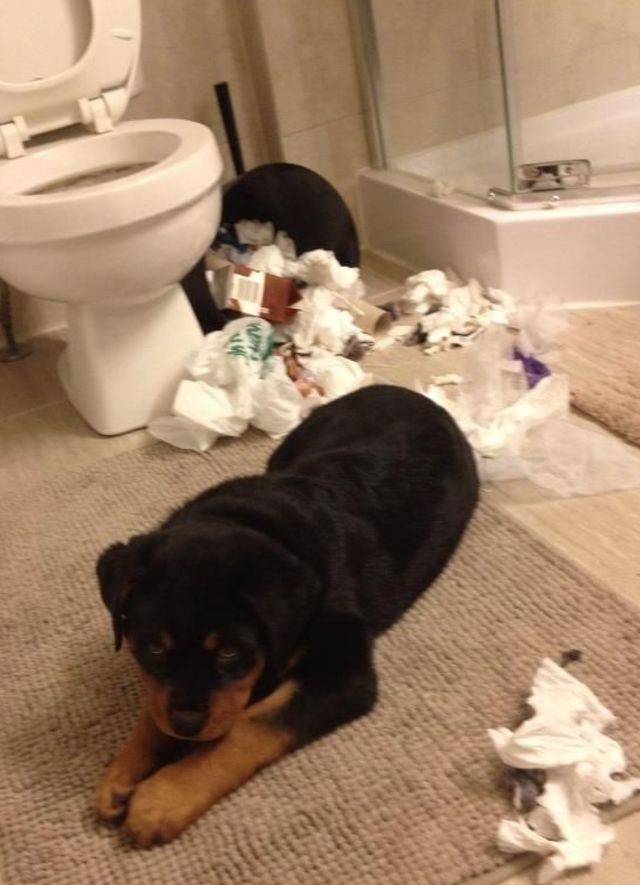
Where is `spilled trash`? This screenshot has width=640, height=885. spilled trash is located at coordinates (273, 282), (262, 374), (573, 755), (520, 443), (480, 363), (468, 297), (253, 227).